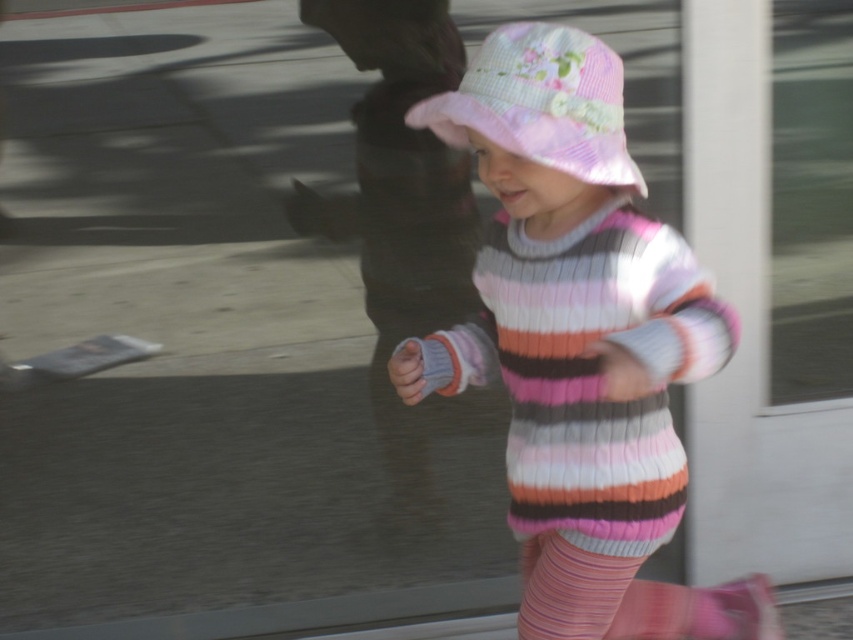
How far apart are pink striped sweater at center and pink seersucker hat at center?

The distance of pink striped sweater at center from pink seersucker hat at center is 21.03 centimeters.

Can you confirm if pink striped sweater at center is wider than pink seersucker hat at center?

Yes.

At what (x,y) coordinates should I click in order to perform the action: click on pink striped sweater at center. Please return your answer as a coordinate pair (x, y). Looking at the image, I should click on (579, 342).